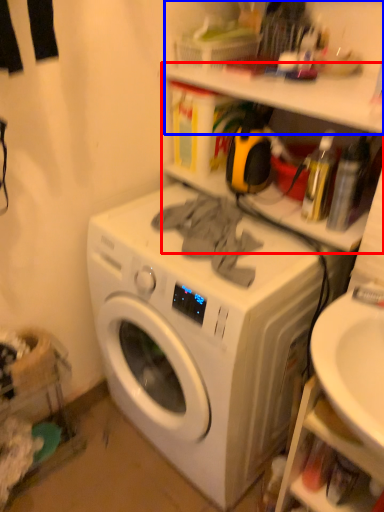
Question: Among these objects, which one is nearest to the camera, shelf (highlighted by a red box) or shelf (highlighted by a blue box)?

Choices:
 (A) shelf
 (B) shelf

Answer: (B)